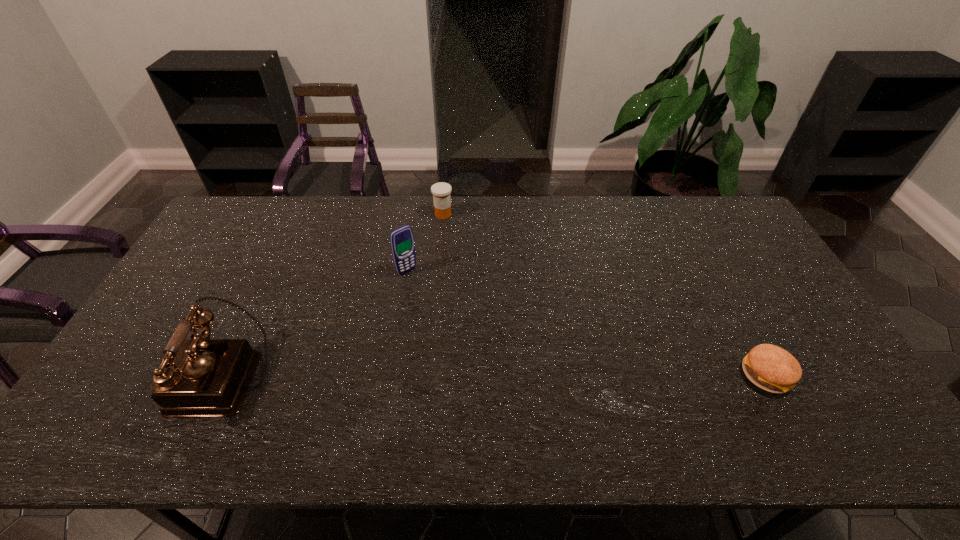
Select which object appears as the closest to the second tallest object. Please provide its 2D coordinates. Your answer should be formatted as a tuple, i.e. [(x, y)], where the tuple contains the x and y coordinates of a point satisfying the conditions above.

[(441, 191)]

I want to click on object that is the second nearest to the cellular telephone, so [x=199, y=377].